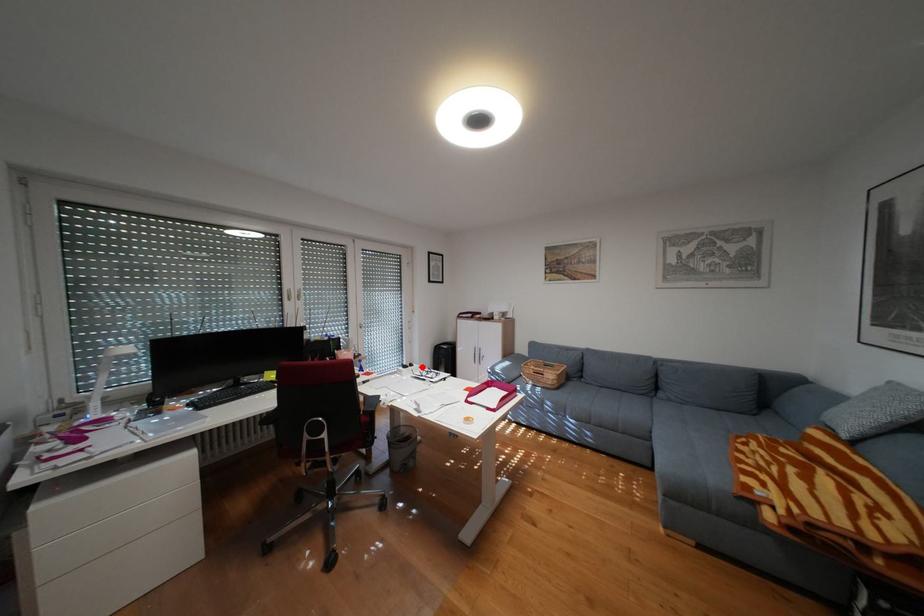
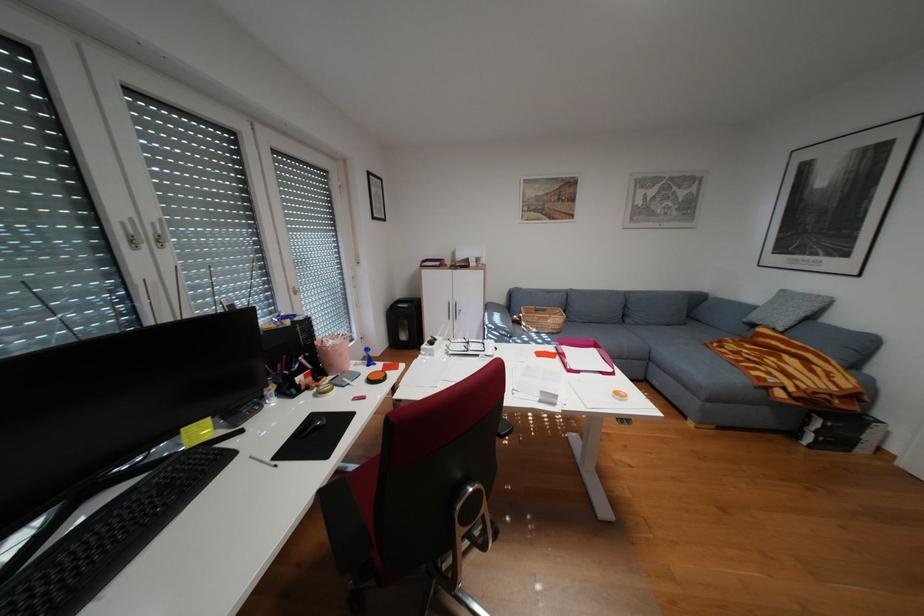
Question: I am providing you with two images of the same scene from different viewpoints. Given a red point in image1, look at the same physical point in image2. Is it:

Choices:
 (A) Closer to the viewpoint
 (B) Farther from the viewpoint

Answer: (B)